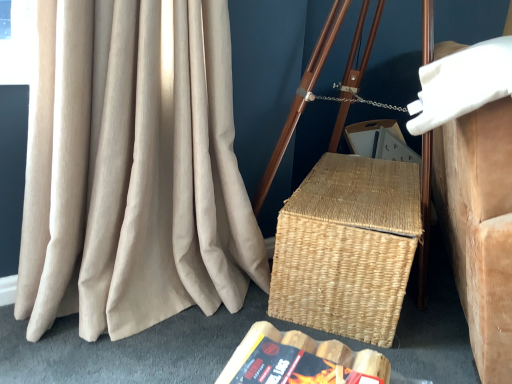
Question: From a real-world perspective, does white foam pillow at upper right stand above beige corduroy curtain at left?

Choices:
 (A) yes
 (B) no

Answer: (B)

Question: Is white foam pillow at upper right looking in the opposite direction of beige corduroy curtain at left?

Choices:
 (A) yes
 (B) no

Answer: (A)

Question: Is white foam pillow at upper right taller than beige corduroy curtain at left?

Choices:
 (A) no
 (B) yes

Answer: (A)

Question: Is beige corduroy curtain at left a part of white foam pillow at upper right?

Choices:
 (A) no
 (B) yes

Answer: (A)

Question: Is white foam pillow at upper right not within beige corduroy curtain at left?

Choices:
 (A) yes
 (B) no

Answer: (A)

Question: Is white foam pillow at upper right shorter than beige corduroy curtain at left?

Choices:
 (A) yes
 (B) no

Answer: (A)

Question: Is natural woven picnic basket at center at the back of beige corduroy curtain at left?

Choices:
 (A) no
 (B) yes

Answer: (A)

Question: Is natural woven picnic basket at center inside beige corduroy curtain at left?

Choices:
 (A) yes
 (B) no

Answer: (B)

Question: Considering the relative sizes of beige corduroy curtain at left and natural woven picnic basket at center in the image provided, is beige corduroy curtain at left smaller than natural woven picnic basket at center?

Choices:
 (A) no
 (B) yes

Answer: (A)

Question: From the image's perspective, does beige corduroy curtain at left appear lower than natural woven picnic basket at center?

Choices:
 (A) no
 (B) yes

Answer: (A)

Question: Is beige corduroy curtain at left at the left side of natural woven picnic basket at center?

Choices:
 (A) no
 (B) yes

Answer: (B)

Question: Can you confirm if beige corduroy curtain at left is bigger than natural woven picnic basket at center?

Choices:
 (A) no
 (B) yes

Answer: (B)

Question: Is the depth of beige corduroy curtain at left greater than that of white foam pillow at upper right?

Choices:
 (A) no
 (B) yes

Answer: (B)